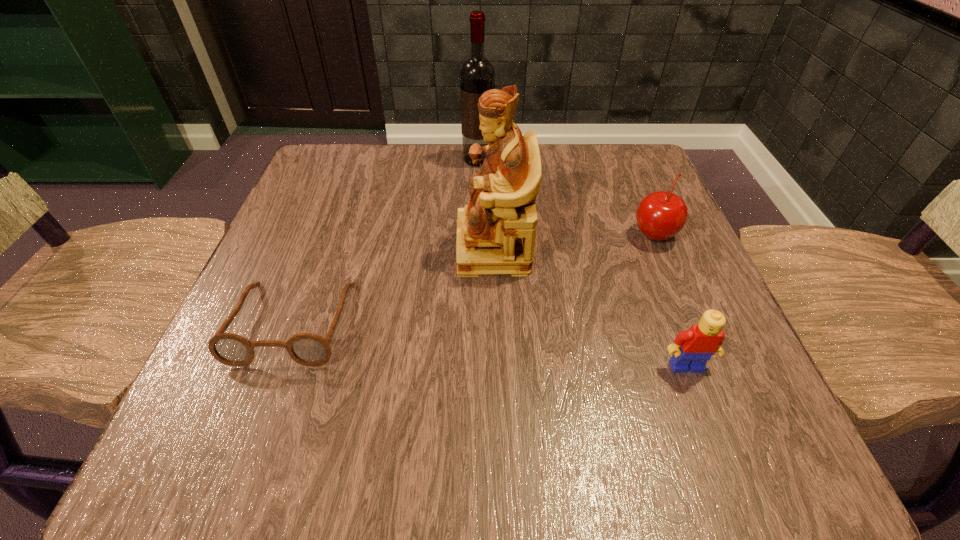
Image resolution: width=960 pixels, height=540 pixels. In order to click on wine bottle in this screenshot , I will do `click(477, 74)`.

Locate an element on the screen. The image size is (960, 540). figurine is located at coordinates (496, 230).

Identify the location of Lego. (701, 341).

This screenshot has width=960, height=540. I want to click on cherry, so click(x=661, y=215).

Where is `spectacles`? Image resolution: width=960 pixels, height=540 pixels. spectacles is located at coordinates (307, 349).

Where is `the leftmost object`? The width and height of the screenshot is (960, 540). the leftmost object is located at coordinates (307, 349).

Identify the location of vacant space situated 0.240m on the left of the farthest object. (359, 160).

This screenshot has height=540, width=960. Find the location of `free space located on the front-facing side of the figurine`. free space located on the front-facing side of the figurine is located at coordinates (278, 247).

You are a GUI agent. You are given a task and a screenshot of the screen. Output one action in this format:
    pyautogui.click(x=<x>, y=<y>)
    Task: Click on the free space located 0.210m on the front-facing side of the figurine
    This screenshot has height=540, width=960.
    Given the screenshot: What is the action you would take?
    pyautogui.click(x=343, y=247)

Where is `free space located 0.200m on the front-facing side of the figurine`? The height and width of the screenshot is (540, 960). free space located 0.200m on the front-facing side of the figurine is located at coordinates (348, 247).